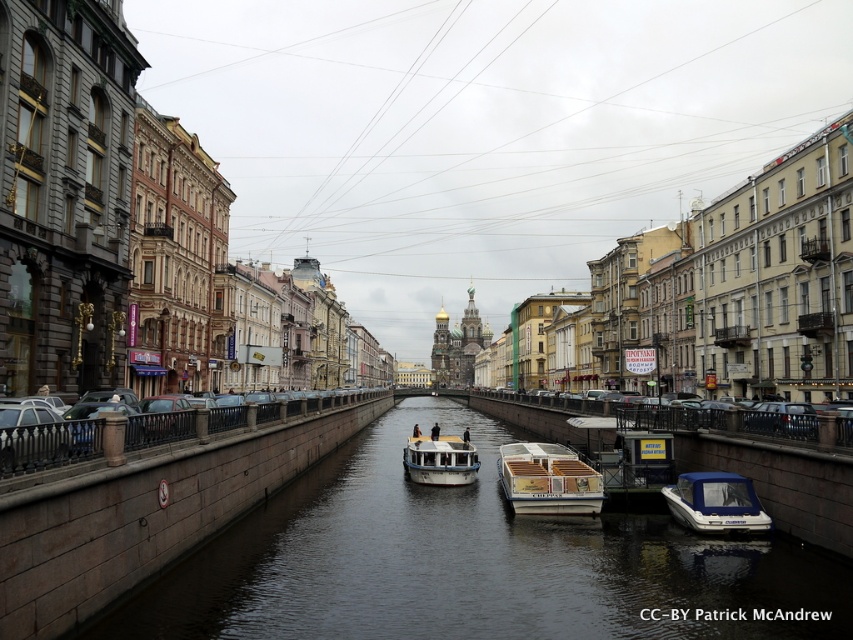
You are a tourist standing on the canal bridge and want to take a photo of both the wooden deck boat at center and the white plastic boat at lower right. Can you see both boats in the same photo without moving your position?

The white plastic boat at lower right is behind the wooden deck boat at center, so it might be partially or fully obscured, making it difficult to capture both in the same photo without moving your position.